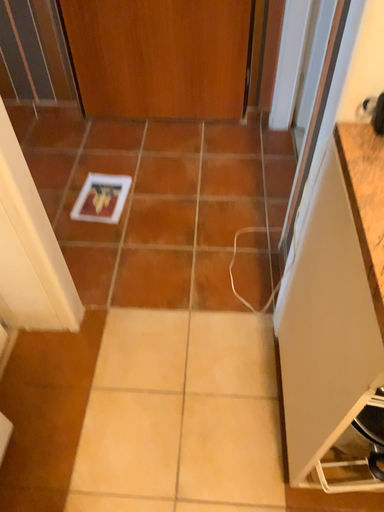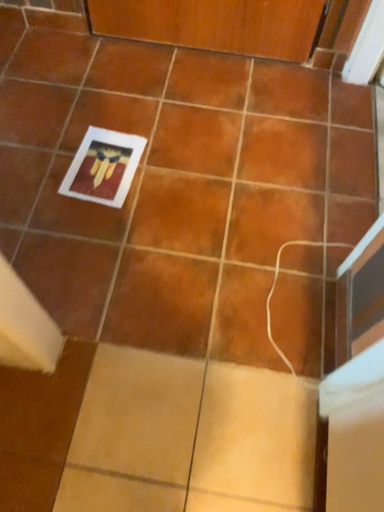
Question: Which way did the camera rotate in the video?

Choices:
 (A) rotated downward
 (B) rotated upward

Answer: (A)